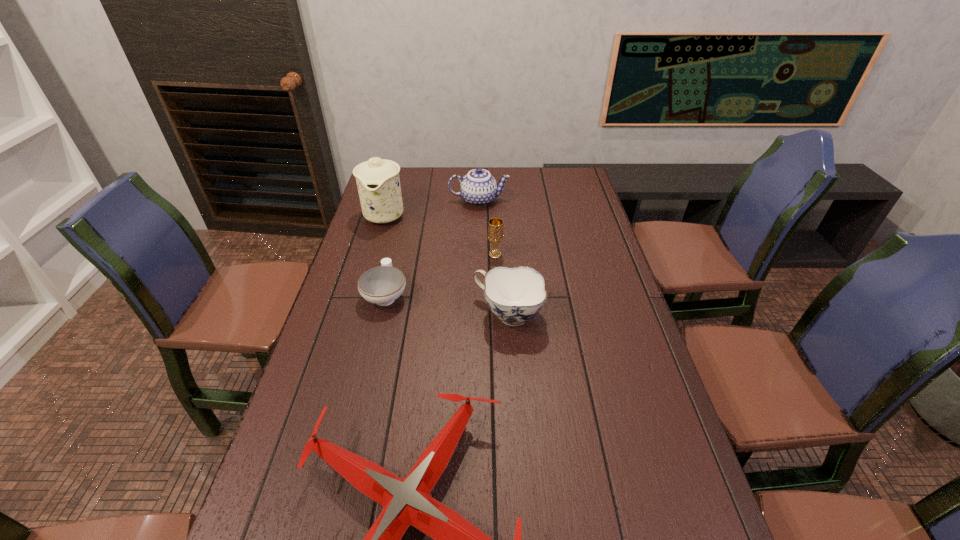
Find the location of a particular element. the tallest object is located at coordinates (378, 182).

Where is `the fourth nearest object`? the fourth nearest object is located at coordinates (495, 226).

Locate an element on the screen. This screenshot has width=960, height=540. the shortest chinaware is located at coordinates coord(382,285).

I want to click on vacant space located on the spout of the tallest chinaware, so click(x=358, y=306).

Find the location of a particular element. This screenshot has width=960, height=540. vacant space located 0.170m on the back of the chalice is located at coordinates (493, 222).

Locate an element on the screen. This screenshot has width=960, height=540. blank space located on the side with the handle of the shortest object is located at coordinates (401, 227).

You are a GUI agent. You are given a task and a screenshot of the screen. Output one action in this format:
    pyautogui.click(x=<x>, y=<y>)
    Task: Click on the free space located on the side with the handle of the shortest object
    This screenshot has height=540, width=960.
    Given the screenshot: What is the action you would take?
    pyautogui.click(x=399, y=235)

Where is `blank space located 0.080m on the side with the handle of the shortest object`? The image size is (960, 540). blank space located 0.080m on the side with the handle of the shortest object is located at coordinates (394, 260).

Locate an element on the screen. The height and width of the screenshot is (540, 960). object at the far edge is located at coordinates (479, 188).

Where is `vacant region at the far edge of the desktop`? The image size is (960, 540). vacant region at the far edge of the desktop is located at coordinates (517, 179).